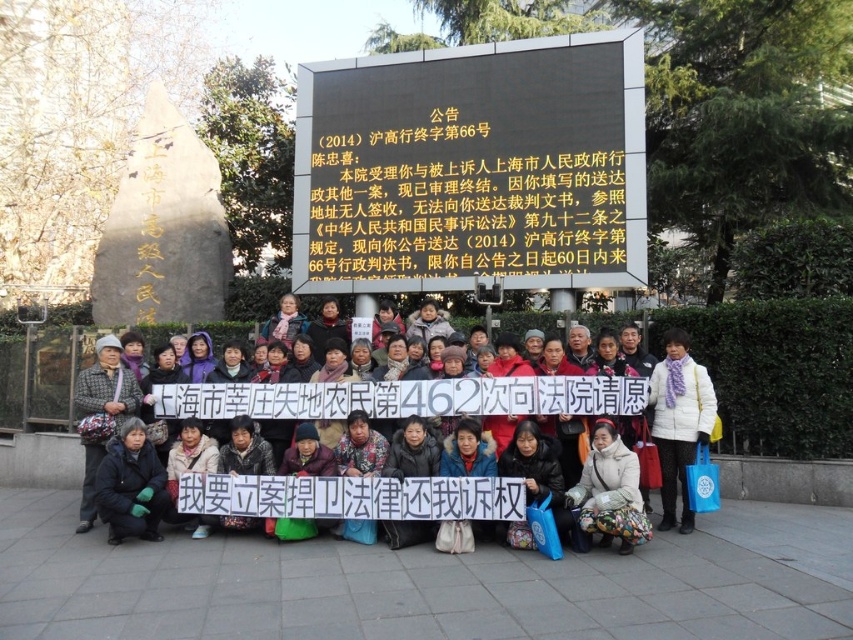
Question: Which point appears closest to the camera in this image?

Choices:
 (A) (666, 417)
 (B) (306, 88)
 (C) (633, 413)

Answer: (C)

Question: Which is farther from the dark gray winter coat at center?

Choices:
 (A) white woolen scarf at center
 (B) black lcd screen at upper center

Answer: (B)

Question: Does black lcd screen at upper center come behind dark gray winter coat at center?

Choices:
 (A) no
 (B) yes

Answer: (B)

Question: Can you confirm if dark gray winter coat at center is thinner than white woolen scarf at center?

Choices:
 (A) no
 (B) yes

Answer: (A)

Question: Is black lcd screen at upper center above white woolen scarf at center?

Choices:
 (A) no
 (B) yes

Answer: (B)

Question: Which of the following is the farthest from the observer?

Choices:
 (A) white woolen scarf at center
 (B) black lcd screen at upper center

Answer: (B)